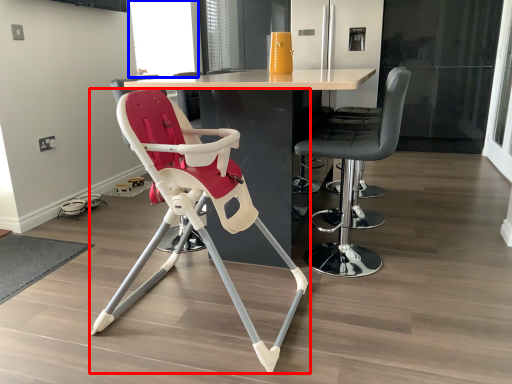
Question: Which point is closer to the camera, chair (highlighted by a red box) or window screen (highlighted by a blue box)?

Choices:
 (A) chair
 (B) window screen

Answer: (A)